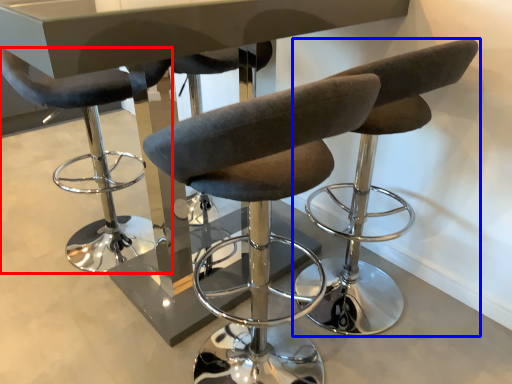
Question: Which object appears closest to the camera in this image, chair (highlighted by a red box) or chair (highlighted by a blue box)?

Choices:
 (A) chair
 (B) chair

Answer: (B)